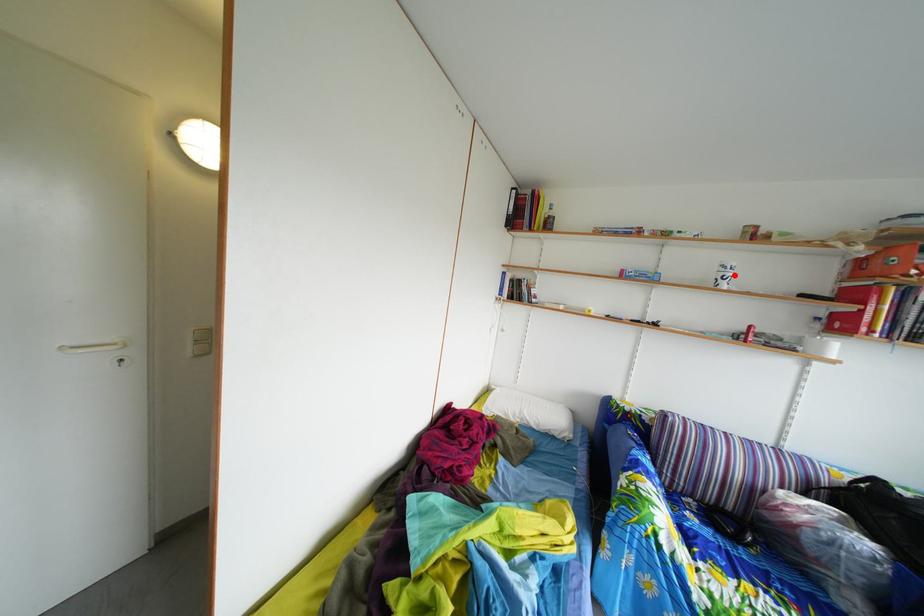
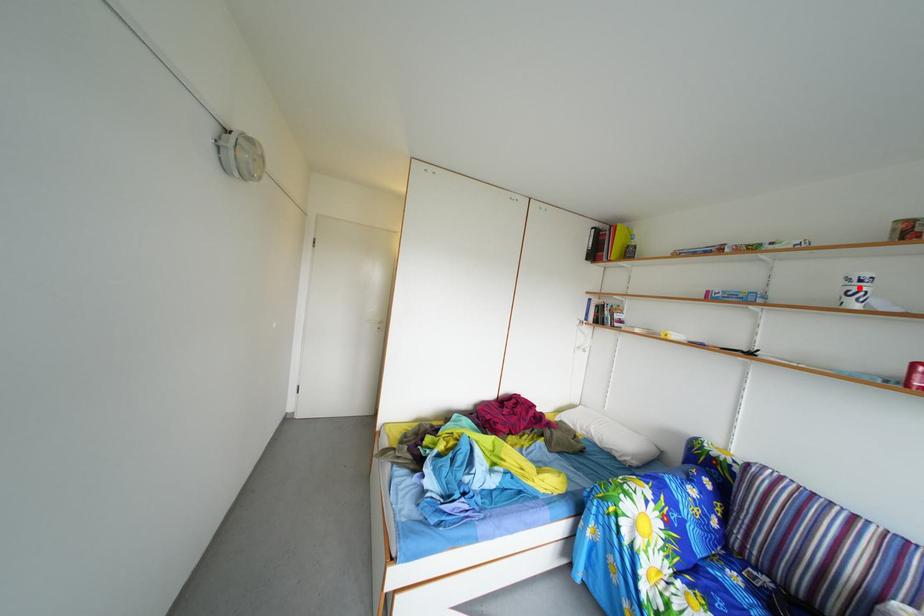
I am providing you with two images of the same scene from different viewpoints. A red point is marked on the first image and another point is marked on the second image. Is the marked point in image1 the same physical position as the marked point in image2?

Yes